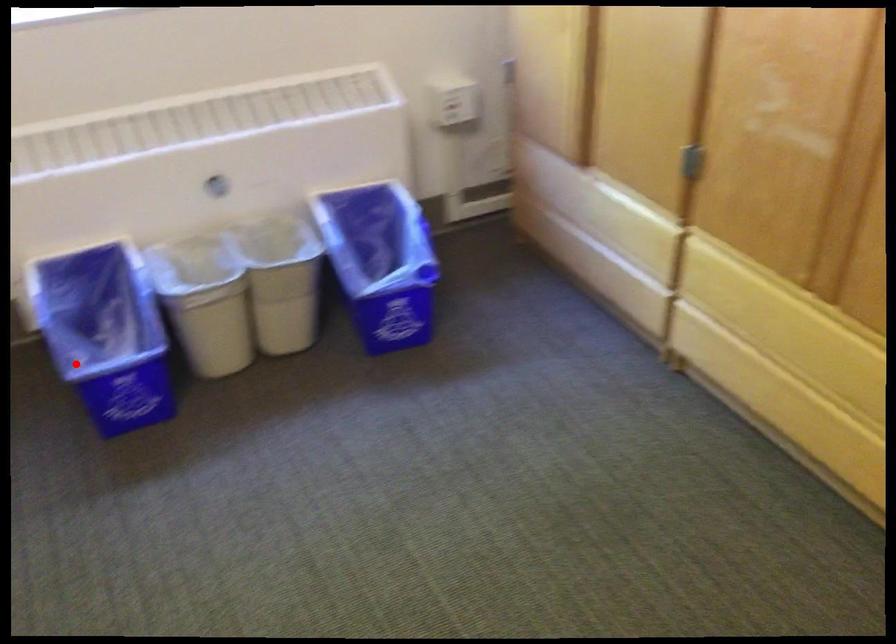
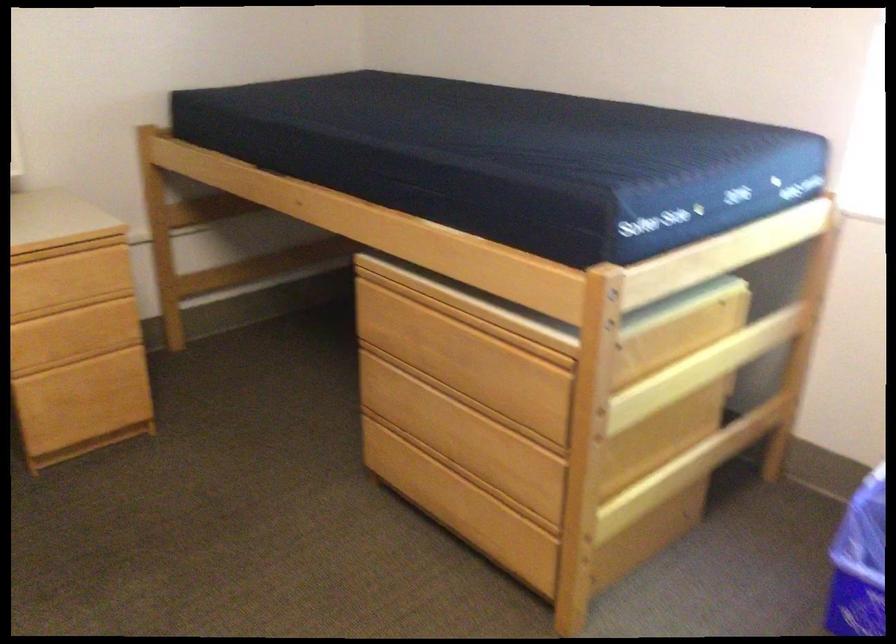
Question: I am providing you with two images of the same scene from different viewpoints. A red point is marked on the first image. Is the red point's position out of view in image 2?

Choices:
 (A) Yes
 (B) No

Answer: (B)